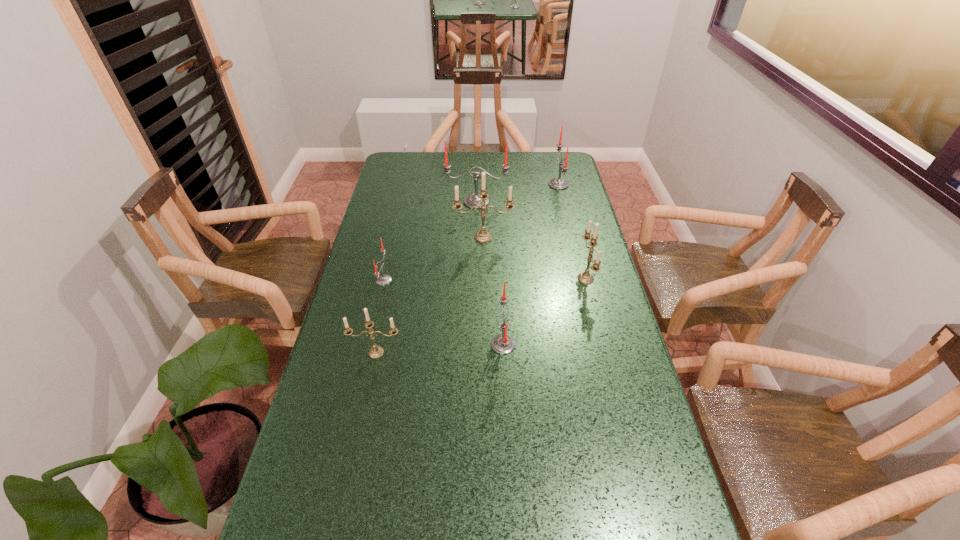
Locate an element on the screen. Image resolution: width=960 pixels, height=540 pixels. vacant space located 0.280m on the right of the nearest metallic candle is located at coordinates (501, 353).

The image size is (960, 540). I want to click on free space located on the front-facing side of the shortest object, so click(x=503, y=280).

At what (x,y) coordinates should I click in order to perform the action: click on object that is positioned at the far edge. Please return your answer as a coordinate pair (x, y). Looking at the image, I should click on (558, 183).

This screenshot has width=960, height=540. In order to click on object located in the far right corner section of the desktop in this screenshot , I will do `click(558, 183)`.

Find the location of `vacant space at the far edge`. vacant space at the far edge is located at coordinates (464, 167).

Identify the location of vacant space at the left edge of the desktop. (357, 320).

Locate an element on the screen. This screenshot has width=960, height=540. vacant space at the right edge of the desktop is located at coordinates (576, 252).

In order to click on vacant area at the far right corner in this screenshot , I will do (567, 160).

Where is `free spot between the second smallest red candle and the biggest red candle`? The image size is (960, 540). free spot between the second smallest red candle and the biggest red candle is located at coordinates (490, 273).

This screenshot has width=960, height=540. In order to click on free space between the leftmost metallic candle and the biggest red candle in this screenshot , I will do `click(426, 277)`.